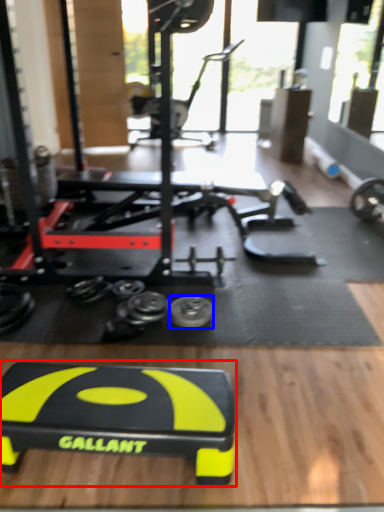
Question: Which object is further to the camera taking this photo, sport equipment (highlighted by a red box) or tire (highlighted by a blue box)?

Choices:
 (A) sport equipment
 (B) tire

Answer: (B)